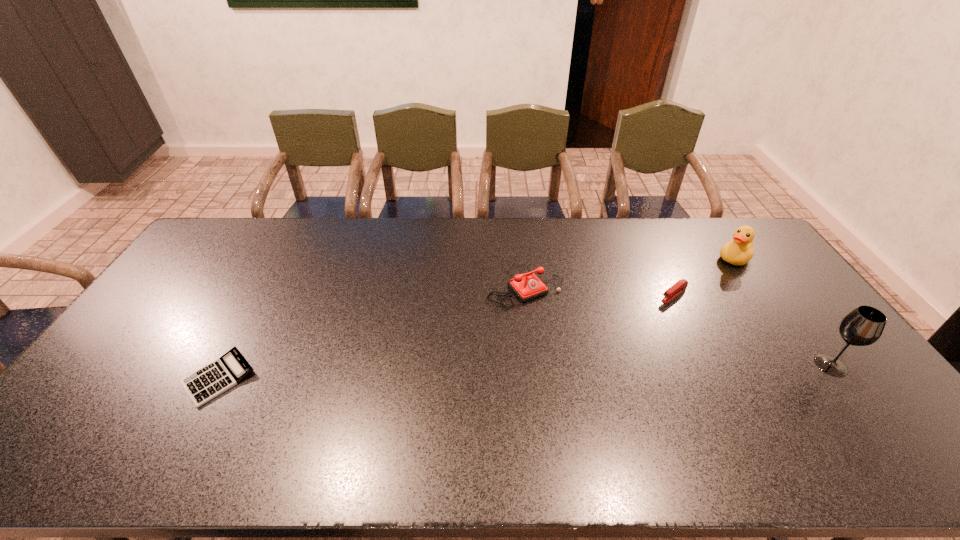
The height and width of the screenshot is (540, 960). Identify the location of vacant area situated on the dial of the third shortest object. (x=580, y=344).

Find the location of a particular element. The width and height of the screenshot is (960, 540). vacant space situated on the dial of the third shortest object is located at coordinates (569, 333).

Where is `blank space located on the dial of the third shortest object`? The height and width of the screenshot is (540, 960). blank space located on the dial of the third shortest object is located at coordinates (595, 361).

You are a GUI agent. You are given a task and a screenshot of the screen. Output one action in this format:
    pyautogui.click(x=<x>, y=<y>)
    Task: Click on the vacant region located on the front-facing side of the second shortest object
    The width and height of the screenshot is (960, 540).
    Given the screenshot: What is the action you would take?
    pyautogui.click(x=580, y=364)

Where is `vacant space positioned 0.390m on the front-facing side of the second shortest object`? vacant space positioned 0.390m on the front-facing side of the second shortest object is located at coordinates (583, 362).

You are a GUI agent. You are given a task and a screenshot of the screen. Output one action in this format:
    pyautogui.click(x=<x>, y=<y>)
    Task: Click on the vacant area situated on the front-facing side of the second shortest object
    The image size is (960, 540).
    Given the screenshot: What is the action you would take?
    pyautogui.click(x=589, y=357)

The image size is (960, 540). In order to click on free space located at the beak of the duck in this screenshot , I will do `click(697, 291)`.

The height and width of the screenshot is (540, 960). Find the location of `vacant area situated at the beak of the duck`. vacant area situated at the beak of the duck is located at coordinates (710, 279).

This screenshot has width=960, height=540. What are the coordinates of `free point located at the beak of the duck` in the screenshot? It's located at (667, 318).

Locate an element on the screen. Image resolution: width=960 pixels, height=540 pixels. object located at the far edge is located at coordinates (739, 251).